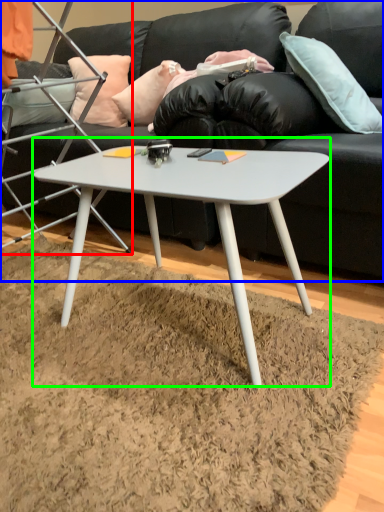
Question: Based on their relative distances, which object is farther from chair (highlighted by a red box)? Choose from studio couch (highlighted by a blue box) and coffee table (highlighted by a green box).

Choices:
 (A) studio couch
 (B) coffee table

Answer: (B)